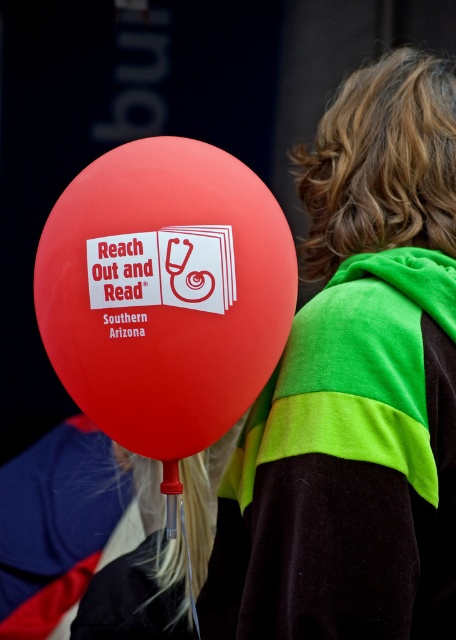
Question: Does matte red balloon at left appear on the left side of matte red balloon at center?

Choices:
 (A) no
 (B) yes

Answer: (A)

Question: Considering the relative positions of matte red balloon at left and matte red balloon at center in the image provided, where is matte red balloon at left located with respect to matte red balloon at center?

Choices:
 (A) below
 (B) above

Answer: (B)

Question: Among these points, which one is farthest from the camera?

Choices:
 (A) (115, 289)
 (B) (211, 586)

Answer: (B)

Question: Does matte red balloon at left appear on the left side of matte red balloon at center?

Choices:
 (A) yes
 (B) no

Answer: (B)